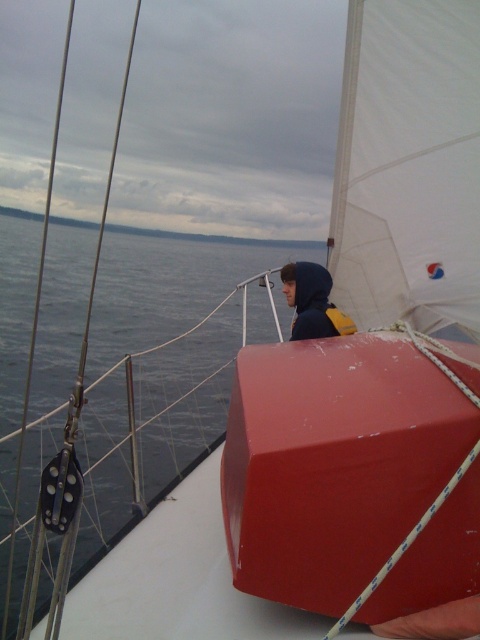
Question: Which point is closer to the camera?

Choices:
 (A) matte black hoodie at center
 (B) matte red box at center

Answer: (B)

Question: From the image, what is the correct spatial relationship of matte red box at center in relation to matte black hoodie at center?

Choices:
 (A) above
 (B) below

Answer: (B)

Question: Is matte red box at center bigger than matte black hoodie at center?

Choices:
 (A) no
 (B) yes

Answer: (B)

Question: Can you confirm if matte red box at center is wider than matte black hoodie at center?

Choices:
 (A) yes
 (B) no

Answer: (A)

Question: Among these points, which one is farthest from the camera?

Choices:
 (A) (311, 356)
 (B) (291, 291)

Answer: (B)